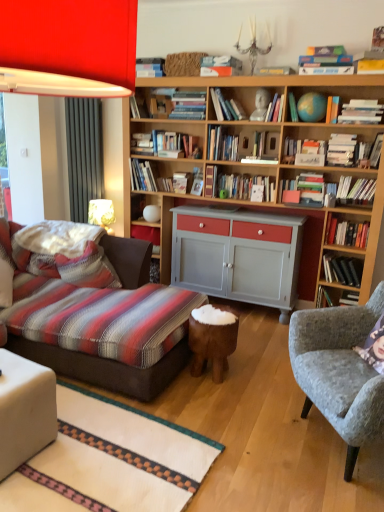
This screenshot has width=384, height=512. I want to click on vacant area on top of hardcover book at right, the eighteenth book positioned from the left (from a real-world perspective), so click(x=354, y=217).